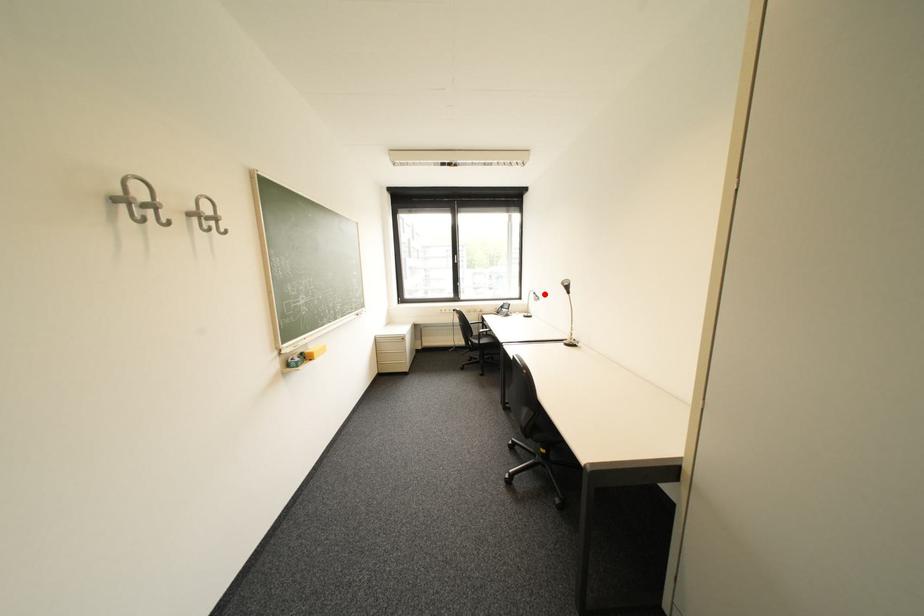
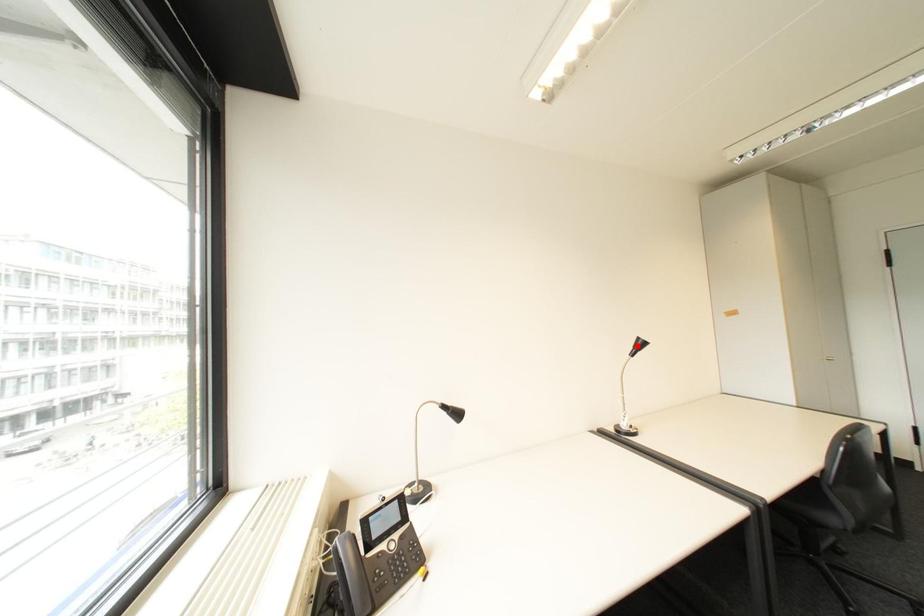
I am providing you with two images of the same scene from different viewpoints. A red point is marked on the first image and another point is marked on the second image. Do the highlighted points in image1 and image2 indicate the same real-world spot?

No